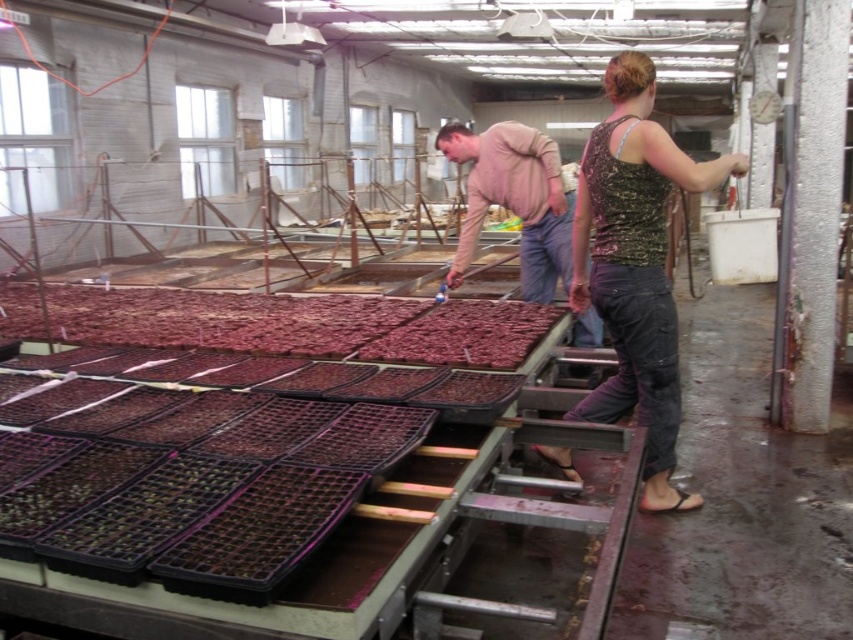
Question: Is black plastic trays at lower left closer to the viewer compared to light brown cotton shirt at center?

Choices:
 (A) no
 (B) yes

Answer: (B)

Question: Can you confirm if camouflage tank top at center is bigger than light brown cotton shirt at center?

Choices:
 (A) yes
 (B) no

Answer: (A)

Question: Which object is the closest to the black plastic trays at lower left?

Choices:
 (A) light brown cotton shirt at center
 (B) camouflage tank top at center

Answer: (B)

Question: Does camouflage tank top at center appear under light brown cotton shirt at center?

Choices:
 (A) no
 (B) yes

Answer: (B)

Question: Which point is farther from the camera taking this photo?

Choices:
 (A) (457, 280)
 (B) (77, 468)

Answer: (A)

Question: Which point is farther from the camera taking this photo?

Choices:
 (A) (659, 362)
 (B) (85, 428)

Answer: (A)